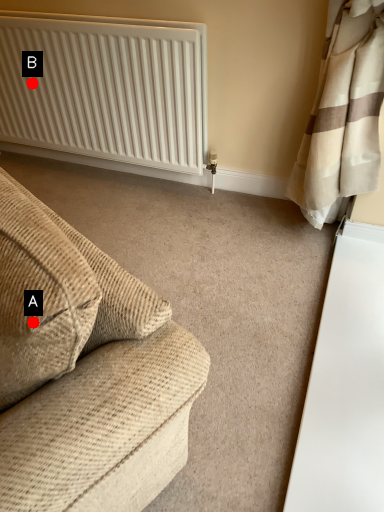
Question: Two points are circled on the image, labeled by A and B beside each circle. Which point appears farthest from the camera in this image?

Choices:
 (A) A is further
 (B) B is further

Answer: (B)